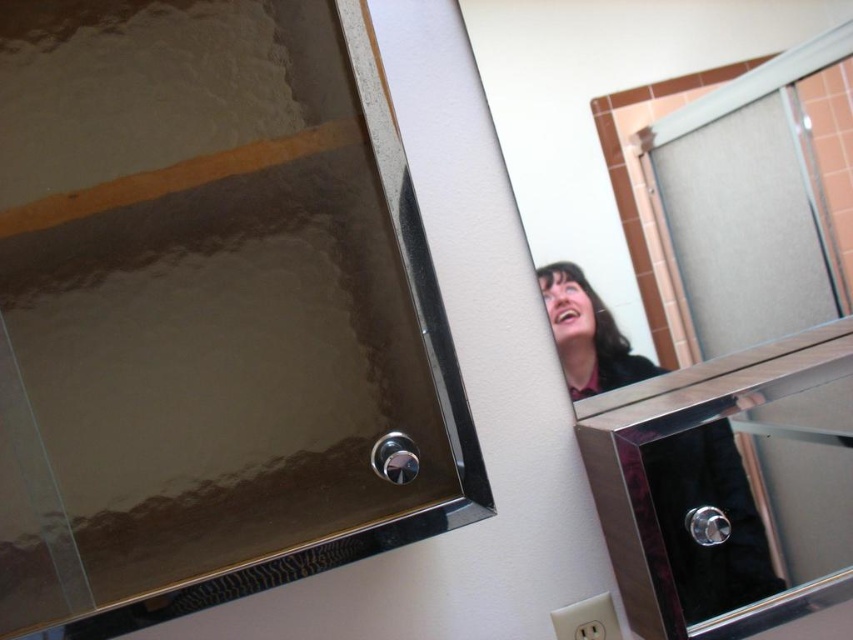
In the scene shown: You are standing in a bathroom and want to place a small decorative item on the glossy metallic mirror at upper center. The item is 10 cm in diameter. Can you fit it without overlapping the two small circular metallic fixtures attached to the mirror frame near the bottom? The bathroom mirror has a metallic frame and is located at point (209, 312). The two fixtures are near the bottom of the frame.

The glossy metallic mirror at upper center has two small circular metallic fixtures attached to its frame near the bottom. Since the fixtures are near the bottom, placing the 10 cm diameter item on the upper part of the mirror would avoid overlapping them.

You are trying to install a new shelf above the glossy metallic mirror at upper center and the polished chrome mirror at upper right. Based on their positions, which mirror should the shelf be placed above?

The shelf should be placed above the polished chrome mirror at upper right because the glossy metallic mirror at upper center is positioned under it, meaning the polished chrome mirror is higher up.

You are holding a 27 inch ruler and want to measure the distance from your eyes to the point marked as point [331,458] in the bathroom mirror. Can you fit the entire ruler between your eyes and that point without bending it?

The distance of point [331,458] from camera is 27.85 inches. Since the ruler is 27 inches long, which is shorter than the distance, you can fit the entire ruler between your eyes and the point without bending it.